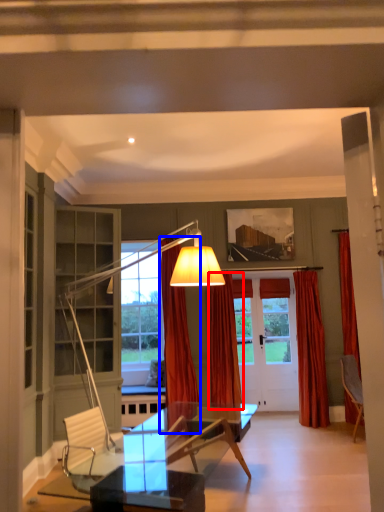
Question: Among these objects, which one is nearest to the camera, curtain (highlighted by a red box) or curtain (highlighted by a blue box)?

Choices:
 (A) curtain
 (B) curtain

Answer: (B)